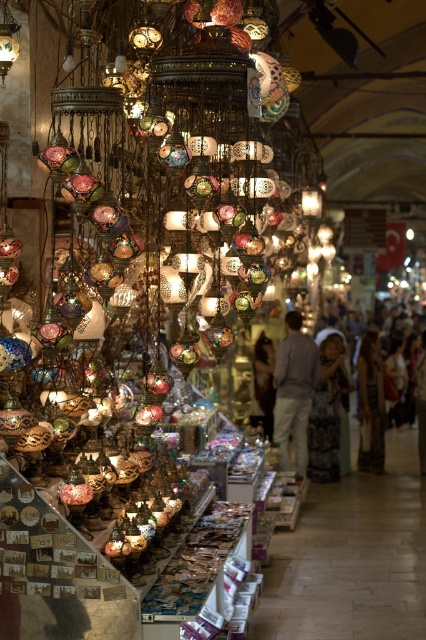
In the scene shown: Which of these two, patterned fabric dress at center or matte brown leather jacket at center, stands taller?

Standing taller between the two is patterned fabric dress at center.

Image resolution: width=426 pixels, height=640 pixels. What do you see at coordinates (327, 412) in the screenshot?
I see `patterned fabric dress at center` at bounding box center [327, 412].

What do you see at coordinates (327, 412) in the screenshot?
I see `patterned fabric dress at center` at bounding box center [327, 412].

The image size is (426, 640). Find the location of `patterned fabric dress at center`. patterned fabric dress at center is located at coordinates (327, 412).

Between light brown cotton shirt at center and patterned fabric dress at center, which one appears on the left side from the viewer's perspective?

From the viewer's perspective, light brown cotton shirt at center appears more on the left side.

Is light brown cotton shirt at center below patterned fabric dress at center?

Incorrect, light brown cotton shirt at center is not positioned below patterned fabric dress at center.

Who is more distant from viewer, (276, 362) or (345, 380)?

The point (345, 380) is more distant.

Identify the location of light brown cotton shirt at center. 293,392.

Does point (331, 339) come farther from viewer compared to point (367, 460)?

No.

Is patterned fabric dress at center smaller than silky white dress at center?

Yes, patterned fabric dress at center is smaller than silky white dress at center.

Which is in front, point (334, 396) or point (362, 468)?

Point (334, 396)

In order to click on patterned fabric dress at center in this screenshot , I will do `click(327, 412)`.